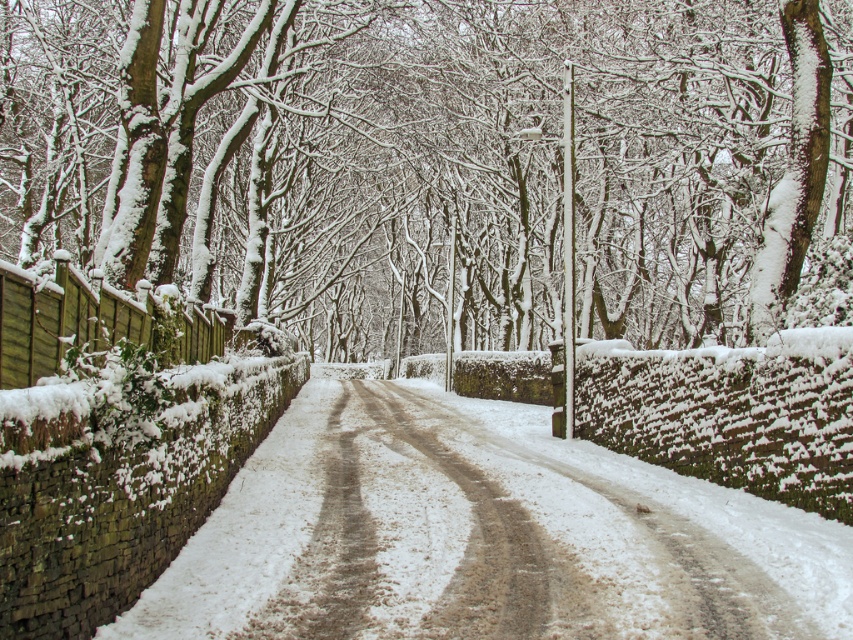
This screenshot has width=853, height=640. Find the location of `snow-covered tree at center`. snow-covered tree at center is located at coordinates (432, 160).

Is point (270, 157) closer to camera compared to point (413, 616)?

No, it is not.

Does point (19, 129) come in front of point (537, 596)?

No, (19, 129) is behind (537, 596).

Locate an element on the screen. This screenshot has width=853, height=640. snow-covered tree at center is located at coordinates (432, 160).